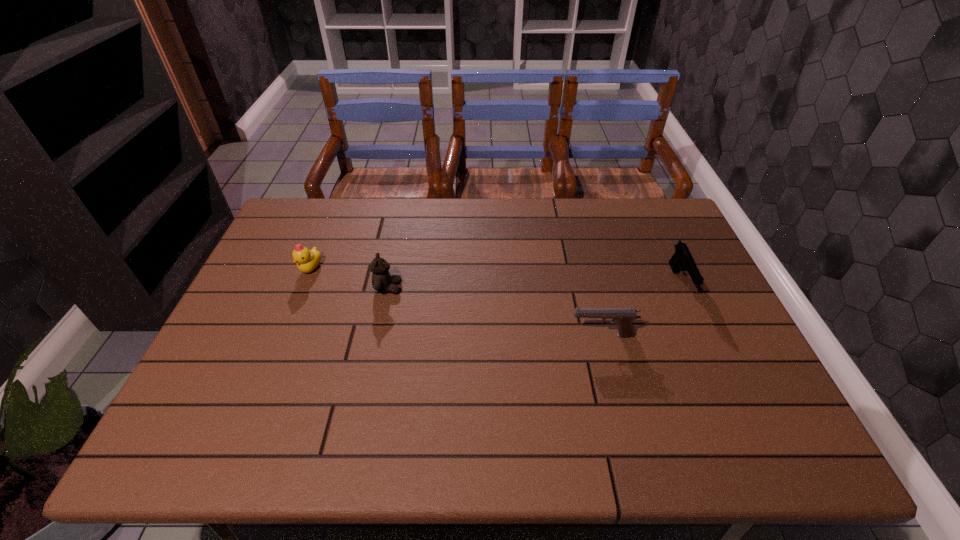
Identify which object is the third nearest to the nearest object. Please provide its 2D coordinates. Your answer should be formatted as a tuple, i.e. [(x, y)], where the tuple contains the x and y coordinates of a point satisfying the conditions above.

[(307, 261)]

Find the location of `vacant region that satisfies the following two spatial constraints: 1. on the front-facing side of the rightmost object; 2. at the barrel of the left pistol`. vacant region that satisfies the following two spatial constraints: 1. on the front-facing side of the rightmost object; 2. at the barrel of the left pistol is located at coordinates (705, 335).

Image resolution: width=960 pixels, height=540 pixels. Identify the location of vacant space that satisfies the following two spatial constraints: 1. on the front-facing side of the farther pistol; 2. on the face of the teddy bear. (x=683, y=288).

You are a GUI agent. You are given a task and a screenshot of the screen. Output one action in this format:
    pyautogui.click(x=<x>, y=<y>)
    Task: Click on the vacant position in the image that satisfies the following two spatial constraints: 1. on the front-facing side of the right pistol; 2. on the face of the third object from right to left
    The image size is (960, 540).
    Given the screenshot: What is the action you would take?
    pyautogui.click(x=683, y=288)